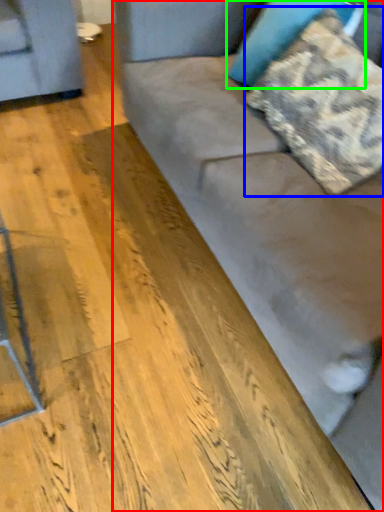
Question: Based on their relative distances, which object is farther from studio couch (highlighted by a red box)? Choose from pillow (highlighted by a blue box) and pillow (highlighted by a green box).

Choices:
 (A) pillow
 (B) pillow

Answer: (B)